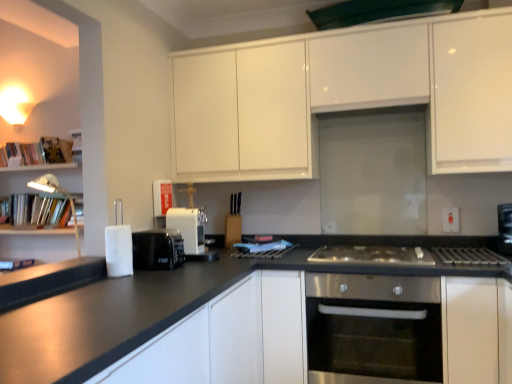
The image size is (512, 384). I want to click on white plastic coffee machine at center, so click(189, 227).

Locate an element on the screen. This screenshot has width=512, height=384. white glossy cabinet at upper center, acting as the third cabinetry starting from the bottom is located at coordinates (344, 95).

Measure the distance between point (456, 229) and camera.

A distance of 7.77 feet exists between point (456, 229) and camera.

Identify the location of white plastic coffee machine at center. (189, 227).

From a real-world perspective, between white plastic lamp at left and white matte cabinet at center, arranged as the 3th cabinetry when viewed from the top, who is vertically lower?

white matte cabinet at center, arranged as the 3th cabinetry when viewed from the top, from a real-world perspective.

Could you tell me if white plastic lamp at left is facing white matte cabinet at center, arranged as the 3th cabinetry when viewed from the top?

No, white plastic lamp at left is not facing towards white matte cabinet at center, arranged as the 3th cabinetry when viewed from the top.

From the image's perspective, which is above, white plastic lamp at left or white matte cabinet at center, arranged as the 3th cabinetry when viewed from the top?

From the image's view, white plastic lamp at left is above.

How much distance is there between white plastic lamp at left and white matte cabinet at center, arranged as the 3th cabinetry when viewed from the top?

white plastic lamp at left is 5.86 feet away from white matte cabinet at center, arranged as the 3th cabinetry when viewed from the top.

This screenshot has width=512, height=384. What are the coordinates of `the 2nd book behind when counting from the white matte cabinet at center, arranged as the 3th cabinetry when viewed from the top` in the screenshot? It's located at point(38,152).

From the image's perspective, is white matte cabinet at center, the first cabinetry from the bottom, positioned above or below hardcover books at left, positioned as the 1th book in top-to-bottom order?

white matte cabinet at center, the first cabinetry from the bottom, is below hardcover books at left, positioned as the 1th book in top-to-bottom order.

Does white matte cabinet at center, arranged as the 3th cabinetry when viewed from the top, have a lesser height compared to hardcover books at left, the second book when ordered from bottom to top?

No.

Which is in front, white matte cabinet at center, arranged as the 3th cabinetry when viewed from the top, or hardcover books at left, the second book when ordered from bottom to top?

white matte cabinet at center, arranged as the 3th cabinetry when viewed from the top, is in front.

Does point (144, 261) come farther from viewer compared to point (78, 244)?

That is False.

Is black plastic toaster at lower left in contact with white plastic lamp at left?

No, black plastic toaster at lower left is not making contact with white plastic lamp at left.

At what (x,y) coordinates should I click in order to perform the action: click on appliance in front of the white plastic lamp at left. Please return your answer as a coordinate pair (x, y). Looking at the image, I should click on (157, 249).

Could white plastic lamp at left be considered to be inside black plastic toaster at lower left?

That's incorrect, white plastic lamp at left is not inside black plastic toaster at lower left.

Who is shorter, hardcover books at left, the 2th book positioned from the top, or green matte exhaust hood at upper center?

Standing shorter between the two is green matte exhaust hood at upper center.

Between hardcover books at left, the 2th book positioned from the top, and green matte exhaust hood at upper center, which one has smaller width?

hardcover books at left, the 2th book positioned from the top.

Which object is more forward, hardcover books at left, the 1th book positioned from the bottom, or green matte exhaust hood at upper center?

green matte exhaust hood at upper center is closer to the camera.

Is hardcover books at left, the 1th book positioned from the bottom, surrounding black plastic toaster at lower left?

No, black plastic toaster at lower left is located outside of hardcover books at left, the 1th book positioned from the bottom.

Is hardcover books at left, the 1th book positioned from the bottom, taller than black plastic toaster at lower left?

Indeed, hardcover books at left, the 1th book positioned from the bottom, has a greater height compared to black plastic toaster at lower left.

Locate an element on the screen. appliance below the hardcover books at left, the 2th book positioned from the top (from the image's perspective) is located at coordinates (157, 249).

Which of these two, hardcover books at left, the 1th book positioned from the bottom, or black plastic toaster at lower left, is bigger?

With larger size is hardcover books at left, the 1th book positioned from the bottom.

What's the angular difference between white plastic lamp at left and stainless steel gas stove at center's facing directions?

There is a 44.2-degree angle between the facing directions of white plastic lamp at left and stainless steel gas stove at center.

Is white plastic lamp at left looking in the opposite direction of stainless steel gas stove at center?

That's not correct — white plastic lamp at left is not looking away from stainless steel gas stove at center.

Image resolution: width=512 pixels, height=384 pixels. I want to click on gas stove located in front of the white plastic lamp at left, so click(x=372, y=255).

From the image's perspective, who appears lower, white plastic lamp at left or stainless steel gas stove at center?

stainless steel gas stove at center.

From a real-world perspective, is hardcover books at left, the second book when ordered from bottom to top, located beneath white plastic coffee machine at center?

Actually, hardcover books at left, the second book when ordered from bottom to top, is physically above white plastic coffee machine at center in the real world.

What's the angular difference between hardcover books at left, positioned as the 1th book in top-to-bottom order, and white plastic coffee machine at center's facing directions?

hardcover books at left, positioned as the 1th book in top-to-bottom order, and white plastic coffee machine at center are facing 92 degrees away from each other.

How much distance is there between hardcover books at left, the second book when ordered from bottom to top, and white plastic coffee machine at center?

A distance of 1.28 meters exists between hardcover books at left, the second book when ordered from bottom to top, and white plastic coffee machine at center.

This screenshot has width=512, height=384. In order to click on book that is the 2nd one when counting leftward from the white plastic coffee machine at center in this screenshot , I will do `click(38, 152)`.

Starting from the white plastic lamp at left, which cabinetry is the 2nd one behind? Please provide its 2D coordinates.

[(228, 339)]

From the image's perspective, count 2nd books upward from the white matte cabinet at center, the first cabinetry from the bottom, and point to it. Please provide its 2D coordinates.

[(38, 152)]

Consider the image. Based on their spatial positions, is stainless steel gas stove at center or hardcover books at left, the 1th book positioned from the bottom, further from white matte cabinet at lower right, the second cabinetry positioned from the top?

Among the two, hardcover books at left, the 1th book positioned from the bottom, is located further to white matte cabinet at lower right, the second cabinetry positioned from the top.

Consider the image. Estimate the real-world distances between objects in this image. Which object is closer to white matte cabinet at lower right, which appears as the 2th cabinetry when ordered from the bottom, white plastic coffee machine at center or stainless steel oven at center?

Based on the image, stainless steel oven at center appears to be nearer to white matte cabinet at lower right, which appears as the 2th cabinetry when ordered from the bottom.

From the image, which object appears to be nearer to white plastic lamp at left, hardcover books at left, the 2th book positioned from the top, or black plastic toaster at lower left?

hardcover books at left, the 2th book positioned from the top, is positioned closer to the anchor white plastic lamp at left.

Considering their positions, is white plastic electric outlet at upper right positioned closer to green matte exhaust hood at upper center than white plastic lamp at left?

white plastic electric outlet at upper right is positioned closer to the anchor green matte exhaust hood at upper center.

Looking at the image, which one is located closer to stainless steel gas stove at center, white plastic coffee machine at center or hardcover books at left, positioned as the 1th book in top-to-bottom order?

white plastic coffee machine at center is positioned closer to the anchor stainless steel gas stove at center.

Estimate the real-world distances between objects in this image. Which object is further from white plastic electric outlet at upper right, white plastic lamp at left or white matte cabinet at lower right, the second cabinetry positioned from the top?

Based on the image, white plastic lamp at left appears to be further to white plastic electric outlet at upper right.

Which object lies further to the anchor point hardcover books at left, positioned as the 1th book in top-to-bottom order, white plastic electric outlet at upper right or black plastic toaster at lower left?

white plastic electric outlet at upper right is further to hardcover books at left, positioned as the 1th book in top-to-bottom order.

Considering their positions, is white matte cabinet at center, the first cabinetry from the bottom, positioned further to white glossy cabinet at upper center, acting as the third cabinetry starting from the bottom, than white plastic lamp at left?

white plastic lamp at left is further to white glossy cabinet at upper center, acting as the third cabinetry starting from the bottom.

Identify the location of gas stove between hardcover books at left, the 1th book positioned from the bottom, and white matte cabinet at lower right, the second cabinetry positioned from the top, from left to right. The width and height of the screenshot is (512, 384). (372, 255).

The height and width of the screenshot is (384, 512). In order to click on cabinetry that lies between white glossy cabinet at upper center, marked as the 1th cabinetry in a top-to-bottom arrangement, and stainless steel oven at center from top to bottom in this screenshot , I will do `click(469, 330)`.

Where is `book situated between hardcover books at left, the second book when ordered from bottom to top, and white glossy cabinet at upper center, acting as the third cabinetry starting from the bottom, from left to right`? book situated between hardcover books at left, the second book when ordered from bottom to top, and white glossy cabinet at upper center, acting as the third cabinetry starting from the bottom, from left to right is located at coordinates (39, 209).

What are the coordinates of `coffee machine between white plastic lamp at left and green matte exhaust hood at upper center` in the screenshot? It's located at (189, 227).